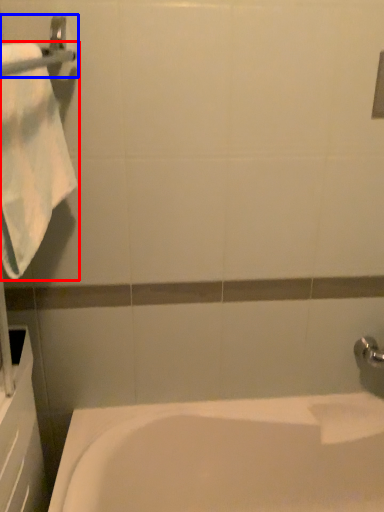
Question: Which object is closer to the camera taking this photo, towel (highlighted by a red box) or towel bar (highlighted by a blue box)?

Choices:
 (A) towel
 (B) towel bar

Answer: (B)